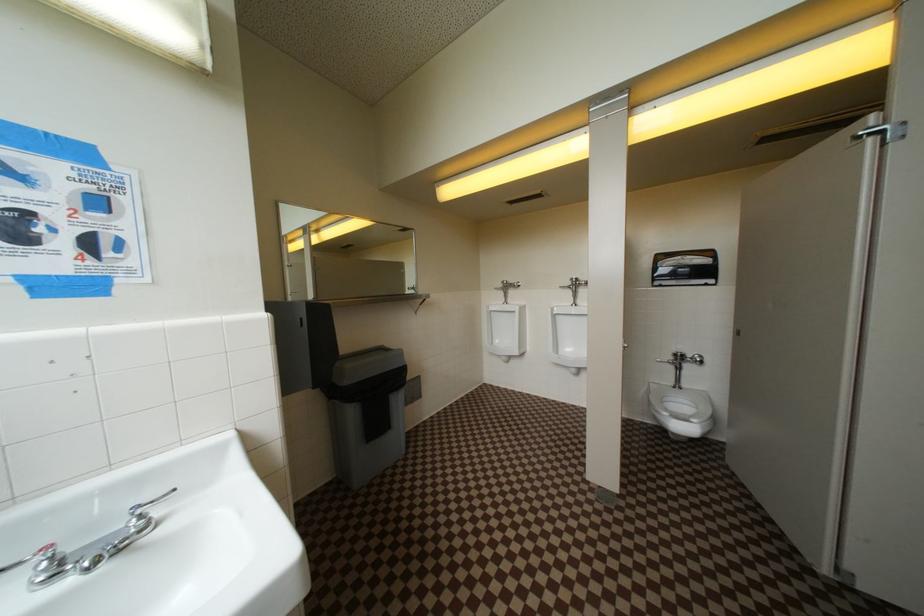
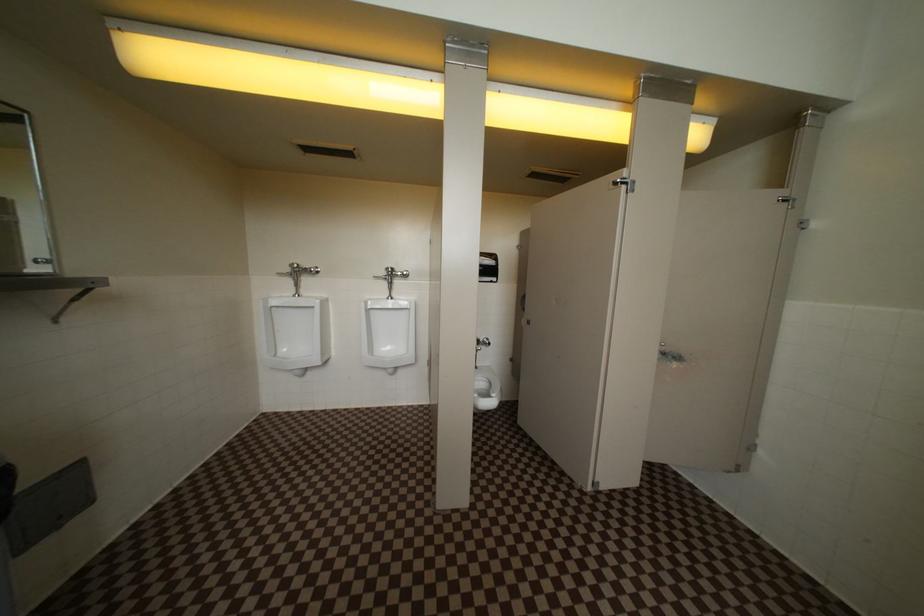
Question: The camera is either moving clockwise (left) or counter-clockwise (right) around the object. The first image is from the beginning of the video and the second image is from the end. Is the camera moving left or right when shooting the video?

Choices:
 (A) Left
 (B) Right

Answer: (A)